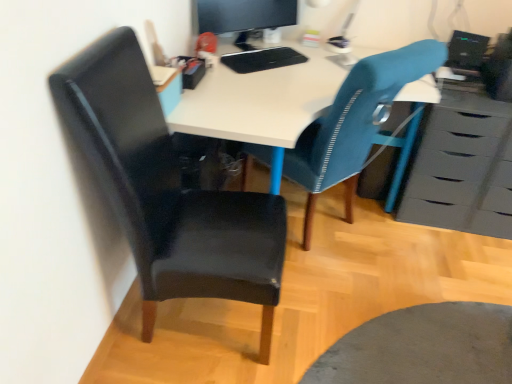
Locate an element on the screen. This screenshot has width=512, height=384. vacant space underneath black leather chair at left, the second chair in the right-to-left sequence (from a real-world perspective) is located at coordinates (208, 326).